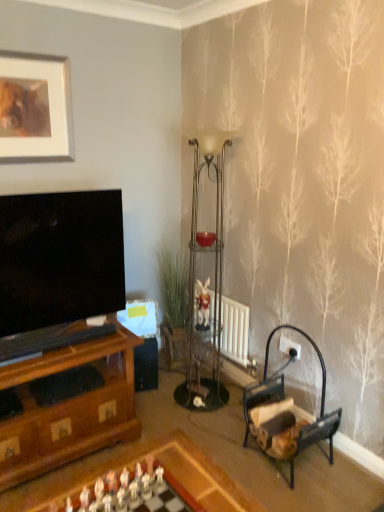
Locate an element on the screen. This screenshot has width=384, height=512. free spot in front of metallic glass shelf at center is located at coordinates (209, 428).